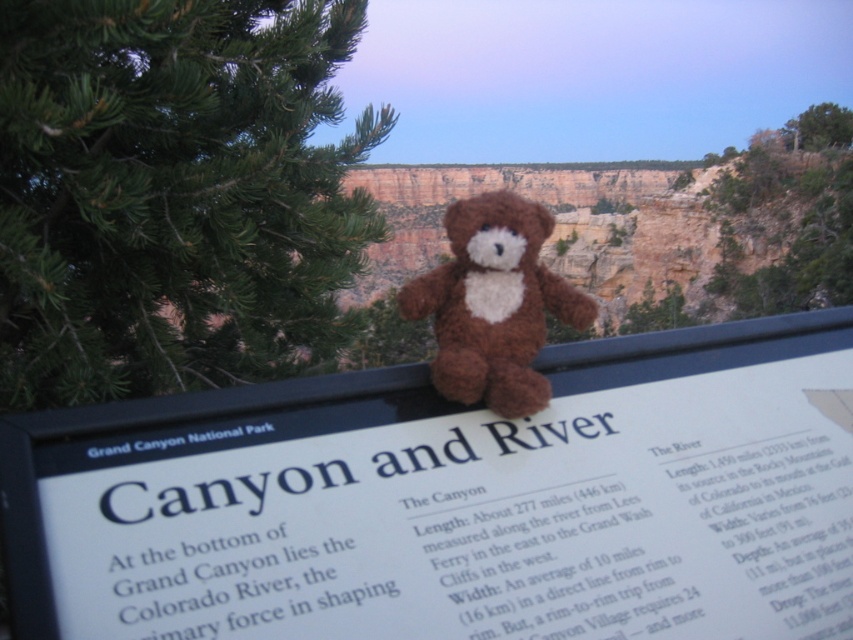
You are standing at the Grand Canyon National Park and see the signboard titled Canyon and River. There are two points marked on the signboard at coordinates point (291, 257) and point (479, 216). Which point is closer to you?

Point (291, 257) is further to the viewer than point (479, 216), so the point closer to you is point (479, 216).